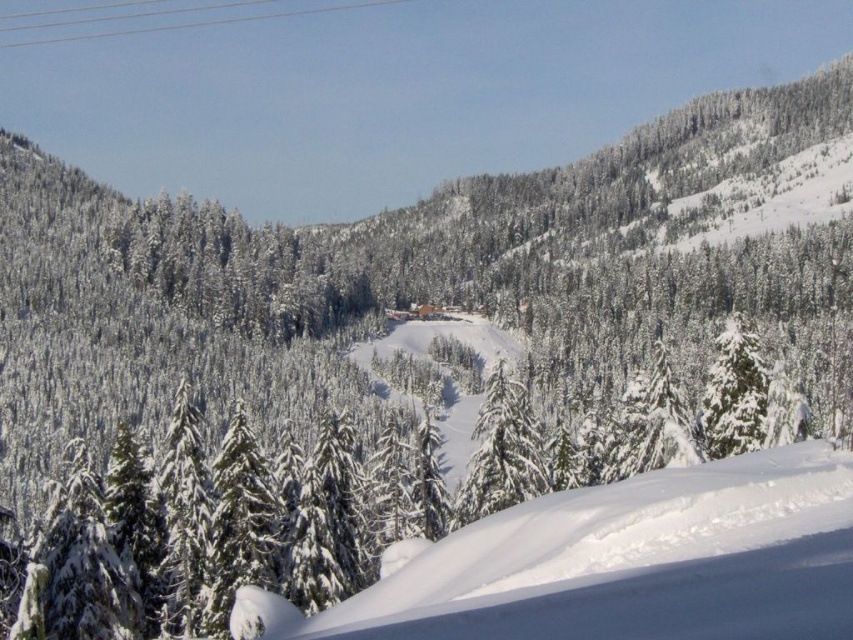
You are a skier standing at the base of the mountain. You want to reach the top of the white snow ski slope at center. Is the point at coordinate point (x=624, y=563) the location of the slope?

Yes, the point at coordinate point (x=624, y=563) is the location of the white snow ski slope at center.